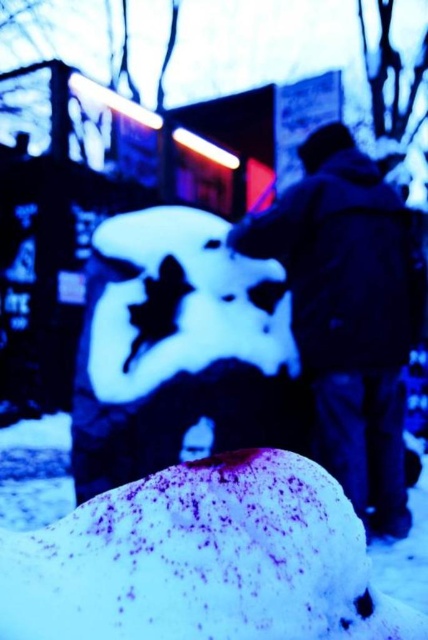
Can you confirm if white fluffy snow at center is positioned below white matte snowman at center?

Yes.

Is white fluffy snow at center wider than white matte snowman at center?

Incorrect, white fluffy snow at center's width does not surpass white matte snowman at center's.

Between point (231, 604) and point (237, 428), which one is positioned in front?

Point (231, 604)

This screenshot has width=428, height=640. Find the location of `white fluffy snow at center`. white fluffy snow at center is located at coordinates (202, 561).

Can you confirm if white matte snowman at center is positioned to the left of dark blue jacket at center?

Indeed, white matte snowman at center is positioned on the left side of dark blue jacket at center.

Is point (125, 388) closer to viewer compared to point (335, 323)?

No, it is behind (335, 323).

This screenshot has width=428, height=640. What are the coordinates of `white matte snowman at center` in the screenshot? It's located at pos(178,348).

Who is higher up, white fluffy snow at center or dark blue jacket at center?

Positioned higher is dark blue jacket at center.

Looking at this image, is white fluffy snow at center thinner than dark blue jacket at center?

Indeed, white fluffy snow at center has a lesser width compared to dark blue jacket at center.

I want to click on white fluffy snow at center, so click(x=202, y=561).

Find the location of a particular element. Image resolution: width=428 pixels, height=640 pixels. white fluffy snow at center is located at coordinates (202, 561).